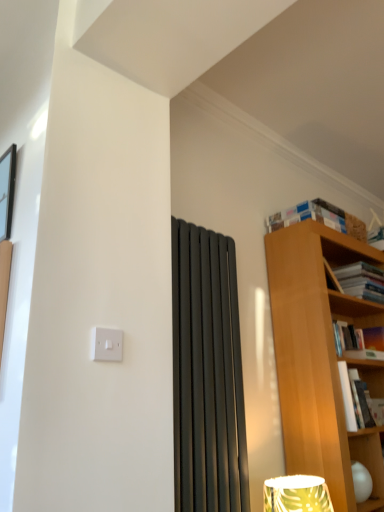
Question: Is hardcover book at upper right, the second book from the bottom, shorter than white paperbacks at upper right, arranged as the fourth book when ordered from the bottom?

Choices:
 (A) yes
 (B) no

Answer: (B)

Question: Is hardcover book at upper right, which ranks as the third book in top-to-bottom order, to the left of white paperbacks at upper right, arranged as the fourth book when ordered from the bottom, from the viewer's perspective?

Choices:
 (A) no
 (B) yes

Answer: (A)

Question: Is hardcover book at upper right, the second book from the bottom, facing away from white paperbacks at upper right, arranged as the fourth book when ordered from the bottom?

Choices:
 (A) yes
 (B) no

Answer: (B)

Question: Considering the relative sizes of hardcover book at upper right, the second book from the bottom, and white paperbacks at upper right, placed as the first book when sorted from top to bottom, in the image provided, is hardcover book at upper right, the second book from the bottom, wider than white paperbacks at upper right, placed as the first book when sorted from top to bottom,?

Choices:
 (A) yes
 (B) no

Answer: (B)

Question: Considering the relative sizes of hardcover book at upper right, the second book from the bottom, and white paperbacks at upper right, arranged as the fourth book when ordered from the bottom, in the image provided, is hardcover book at upper right, the second book from the bottom, thinner than white paperbacks at upper right, arranged as the fourth book when ordered from the bottom,?

Choices:
 (A) yes
 (B) no

Answer: (A)

Question: Does hardcover book at upper right, which ranks as the third book in top-to-bottom order, come behind white paperbacks at upper right, placed as the first book when sorted from top to bottom?

Choices:
 (A) yes
 (B) no

Answer: (A)

Question: Does hardcover book at upper right, which ranks as the third book in bottom-to-top order, have a greater height compared to white plastic light switch at upper left?

Choices:
 (A) no
 (B) yes

Answer: (B)

Question: Is hardcover book at upper right, arranged as the second book when viewed from the top, positioned before white plastic light switch at upper left?

Choices:
 (A) yes
 (B) no

Answer: (B)

Question: Is hardcover book at upper right, arranged as the second book when viewed from the top, further to the viewer compared to white plastic light switch at upper left?

Choices:
 (A) yes
 (B) no

Answer: (A)

Question: Does hardcover book at upper right, which ranks as the third book in bottom-to-top order, have a larger size compared to white plastic light switch at upper left?

Choices:
 (A) no
 (B) yes

Answer: (B)

Question: Does hardcover book at upper right, which ranks as the third book in bottom-to-top order, contain white plastic light switch at upper left?

Choices:
 (A) yes
 (B) no

Answer: (B)

Question: Considering the relative positions of hardcover book at upper right, which ranks as the third book in bottom-to-top order, and white plastic light switch at upper left in the image provided, is hardcover book at upper right, which ranks as the third book in bottom-to-top order, to the left of white plastic light switch at upper left from the viewer's perspective?

Choices:
 (A) yes
 (B) no

Answer: (B)

Question: Is white paperbacks at upper right, arranged as the fourth book when ordered from the bottom, not inside hardcover book at upper right, which ranks as the third book in top-to-bottom order?

Choices:
 (A) no
 (B) yes

Answer: (B)